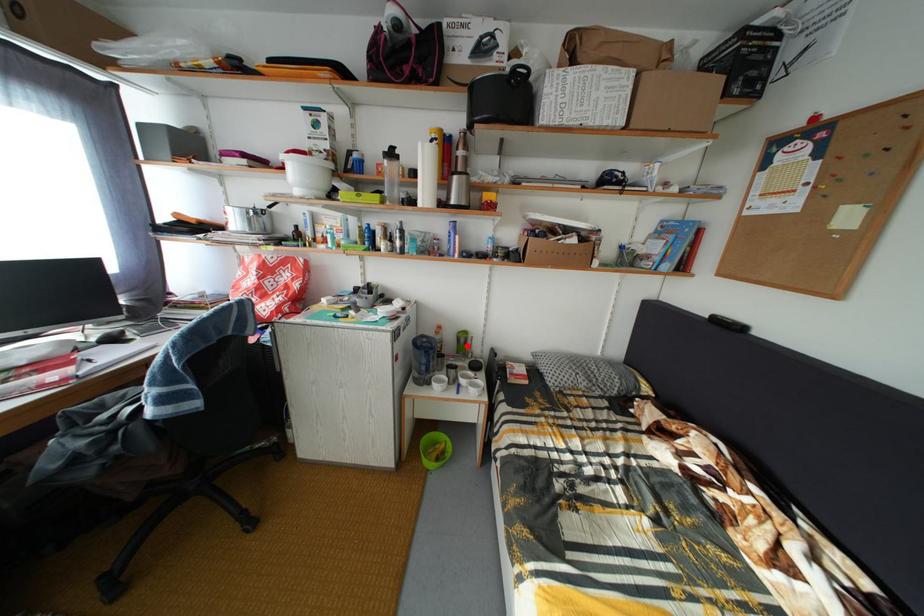
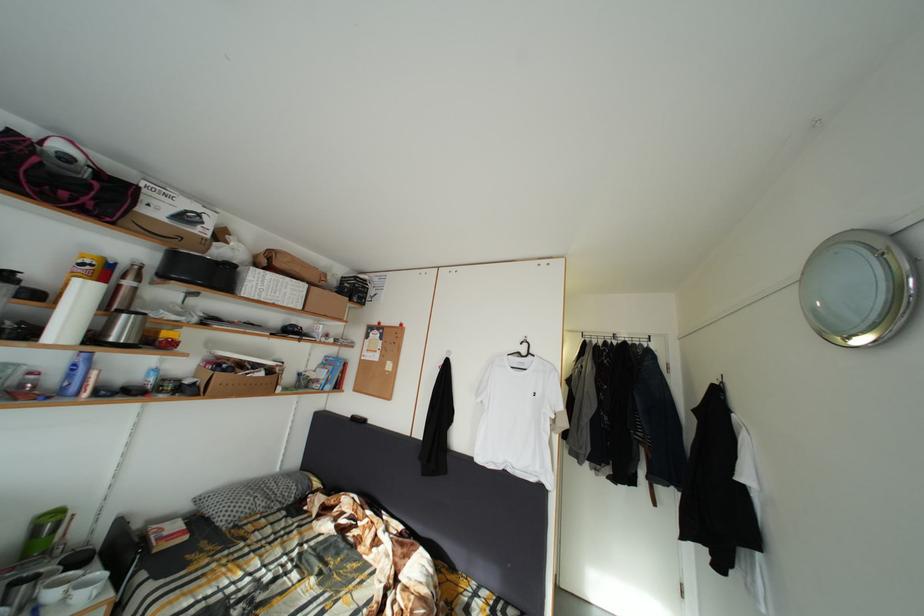
Question: I am providing you with two images of the same scene from different viewpoints. Given a red point in image1, look at the same physical point in image2. Is it:

Choices:
 (A) Closer to the viewpoint
 (B) Farther from the viewpoint

Answer: (A)